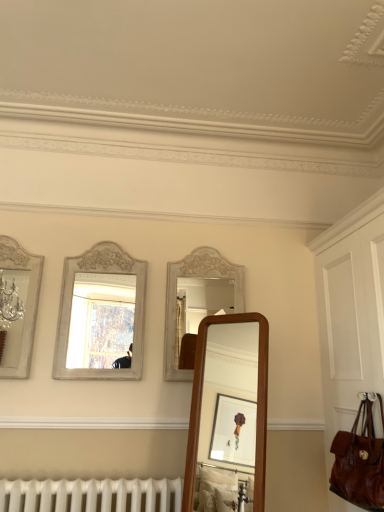
Question: From the image's perspective, is white painted wood mirror at center, the 2th mirror viewed from the left, located above or below brown leather bag at right?

Choices:
 (A) above
 (B) below

Answer: (A)

Question: Based on their sizes in the image, would you say white painted wood mirror at center, marked as the first mirror in a right-to-left arrangement, is bigger or smaller than brown leather bag at right?

Choices:
 (A) big
 (B) small

Answer: (B)

Question: Which of these objects is positioned farthest from the white painted wood mirror at center, the 2th mirror viewed from the left?

Choices:
 (A) silver metallic mirror at left, arranged as the 1th mirror when viewed from the left
 (B) brown leather handbag at lower right
 (C) brown leather bag at right

Answer: (B)

Question: Estimate the real-world distances between objects in this image. Which object is closer to the silver metallic mirror at left, arranged as the 1th mirror when viewed from the left?

Choices:
 (A) white painted wood mirror at center, the 2th mirror viewed from the left
 (B) brown leather bag at right
 (C) brown leather handbag at lower right

Answer: (A)